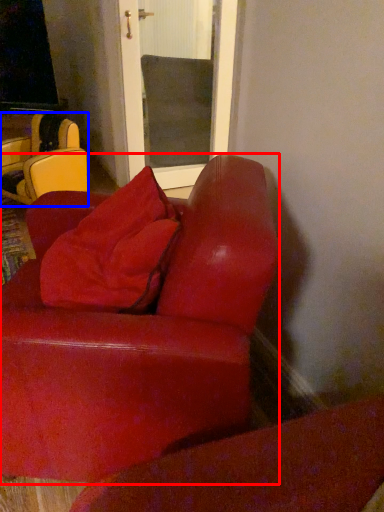
Question: Which point is further to the camera, studio couch (highlighted by a red box) or chair (highlighted by a blue box)?

Choices:
 (A) studio couch
 (B) chair

Answer: (B)